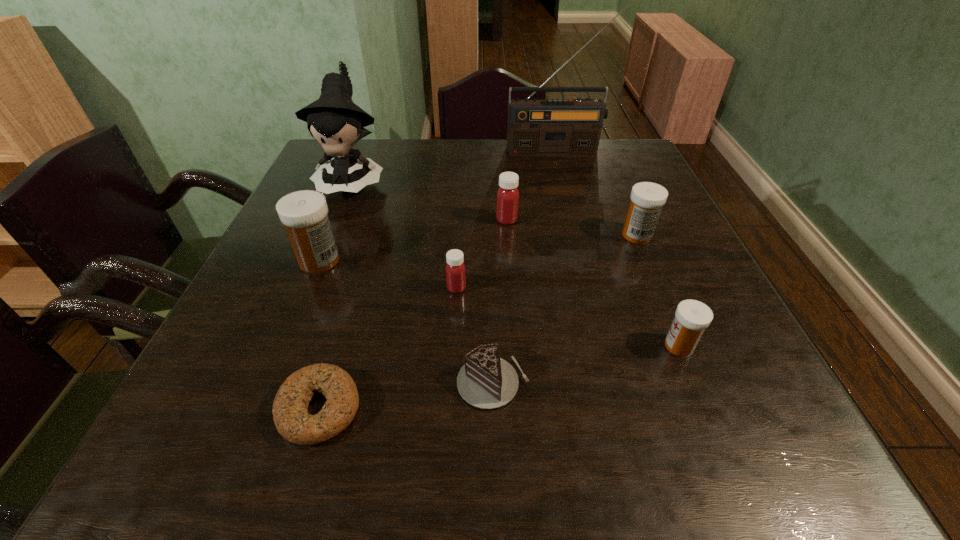
Identify the location of the tallest object. The width and height of the screenshot is (960, 540). (536, 127).

At what (x,y) coordinates should I click in order to perform the action: click on the farthest object. Please return your answer as a coordinate pair (x, y). The height and width of the screenshot is (540, 960). Looking at the image, I should click on (536, 127).

Find the location of a particular element. The height and width of the screenshot is (540, 960). doll is located at coordinates (333, 120).

Image resolution: width=960 pixels, height=540 pixels. Identify the location of the second tallest object. (333, 120).

Identify the location of the second nearest white medicine. This screenshot has width=960, height=540. (304, 213).

Locate an element on the screen. the fifth farthest object is located at coordinates (304, 213).

Locate an element on the screen. The height and width of the screenshot is (540, 960). the farthest white medicine is located at coordinates (647, 199).

Where is `the farther red medicine`? the farther red medicine is located at coordinates (508, 195).

The height and width of the screenshot is (540, 960). I want to click on the third medicine from left to right, so click(508, 195).

The image size is (960, 540). Find the location of `the nearer red medicine`. the nearer red medicine is located at coordinates (455, 269).